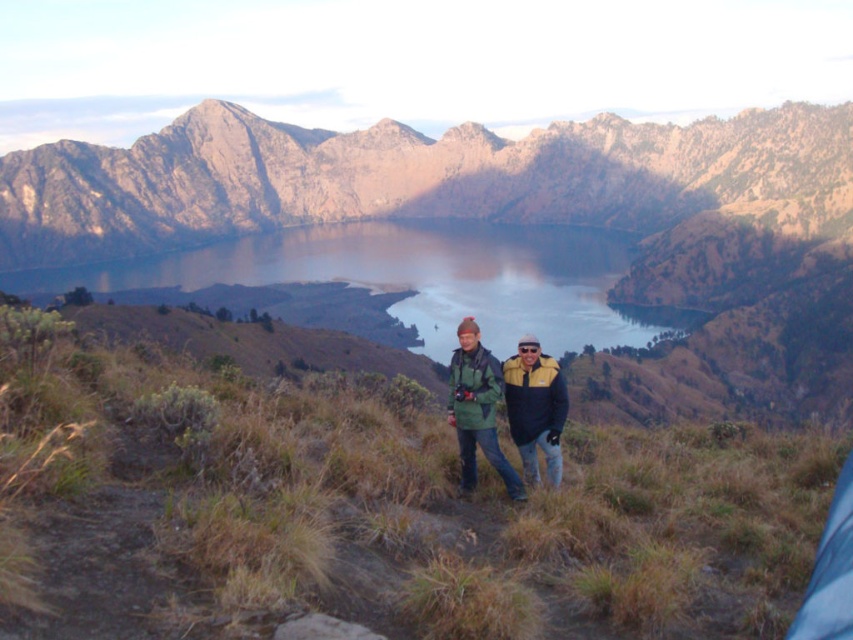
Looking at this image, you are a drone operator trying to capture the best aerial shot of the brown rocky mountain at upper center. You have a drone with a camera that can only focus on a single point. The point you must focus on is point (x=401, y=177). Is this point located on the brown rocky mountain at upper center?

Yes, the point (x=401, y=177) is located on the brown rocky mountain at upper center according to the description.